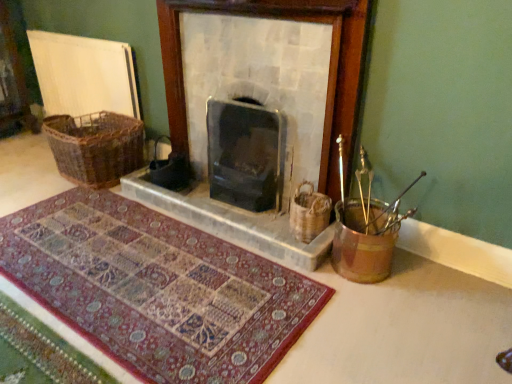
Question: Can you confirm if metallic gold bucket at right is positioned to the left of carpeted mat at center?

Choices:
 (A) yes
 (B) no

Answer: (B)

Question: Is metallic gold bucket at right to the right of carpeted mat at center from the viewer's perspective?

Choices:
 (A) no
 (B) yes

Answer: (B)

Question: From a real-world perspective, does metallic gold bucket at right stand above carpeted mat at center?

Choices:
 (A) yes
 (B) no

Answer: (A)

Question: From the image's perspective, is metallic gold bucket at right on carpeted mat at center?

Choices:
 (A) yes
 (B) no

Answer: (A)

Question: Considering the relative sizes of metallic gold bucket at right and carpeted mat at center in the image provided, is metallic gold bucket at right smaller than carpeted mat at center?

Choices:
 (A) yes
 (B) no

Answer: (A)

Question: Considering their positions, is stone fireplace at center located in front of or behind carpeted mat at center?

Choices:
 (A) front
 (B) behind

Answer: (B)

Question: Is stone fireplace at center wider or thinner than carpeted mat at center?

Choices:
 (A) wide
 (B) thin

Answer: (B)

Question: Looking at the image, does stone fireplace at center seem bigger or smaller compared to carpeted mat at center?

Choices:
 (A) big
 (B) small

Answer: (A)

Question: Visually, is stone fireplace at center positioned to the left or to the right of carpeted mat at center?

Choices:
 (A) right
 (B) left

Answer: (A)

Question: In terms of width, does carpeted mat at center look wider or thinner when compared to woven brown basket at right, the second basket viewed from the top?

Choices:
 (A) thin
 (B) wide

Answer: (B)

Question: Based on their sizes in the image, would you say carpeted mat at center is bigger or smaller than woven brown basket at right, marked as the first basket in a right-to-left arrangement?

Choices:
 (A) big
 (B) small

Answer: (A)

Question: Do you think carpeted mat at center is within woven brown basket at right, marked as the first basket in a right-to-left arrangement, or outside of it?

Choices:
 (A) inside
 (B) outside

Answer: (B)

Question: From a real-world perspective, is carpeted mat at center physically located above or below woven brown basket at right, marked as the first basket in a bottom-to-top arrangement?

Choices:
 (A) below
 (B) above

Answer: (A)

Question: Considering their positions, is woven brown basket at left, the first basket when ordered from back to front, located in front of or behind metallic gold bucket at right?

Choices:
 (A) front
 (B) behind

Answer: (B)

Question: Is woven brown basket at left, the first basket when ordered from back to front, to the left or to the right of metallic gold bucket at right in the image?

Choices:
 (A) left
 (B) right

Answer: (A)